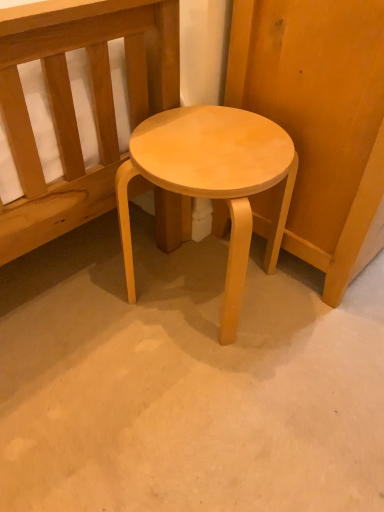
Describe the element at coordinates (213, 181) in the screenshot. The height and width of the screenshot is (512, 384). I see `light wood stool at center` at that location.

Locate an element on the screen. light wood stool at center is located at coordinates (213, 181).

Locate an element on the screen. The height and width of the screenshot is (512, 384). light wood stool at center is located at coordinates (213, 181).